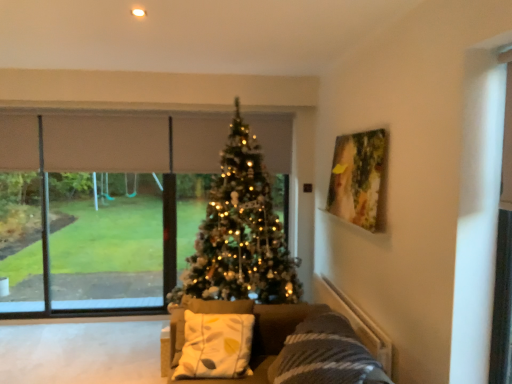
The width and height of the screenshot is (512, 384). What do you see at coordinates (240, 233) in the screenshot? I see `iridescent gold christmas tree at center` at bounding box center [240, 233].

Where is `iridescent gold christmas tree at center`? iridescent gold christmas tree at center is located at coordinates (240, 233).

Image resolution: width=512 pixels, height=384 pixels. Describe the element at coordinates (96, 239) in the screenshot. I see `transparent glass window at center` at that location.

Find the location of a particular element. This screenshot has width=512, height=384. iridescent gold christmas tree at center is located at coordinates (240, 233).

Considering the positions of objects velvet grey couch at center and iridescent gold christmas tree at center in the image provided, who is behind, velvet grey couch at center or iridescent gold christmas tree at center?

iridescent gold christmas tree at center is behind.

Which is behind, point (203, 330) or point (215, 229)?

Point (215, 229)

Which of these two, velvet grey couch at center or iridescent gold christmas tree at center, stands shorter?

Standing shorter between the two is velvet grey couch at center.

Are iridescent gold christmas tree at center and transparent glass screen door at right beside each other?

No.

Is transparent glass screen door at right completely or partially inside iridescent gold christmas tree at center?

No, transparent glass screen door at right is not surrounded by iridescent gold christmas tree at center.

The height and width of the screenshot is (384, 512). In order to click on screen door on the right of iridescent gold christmas tree at center in this screenshot , I will do `click(503, 253)`.

Who is shorter, iridescent gold christmas tree at center or transparent glass screen door at right?

Answer: transparent glass screen door at right is shorter.

Which object is thinner, wooden painting at upper right or white fabric pillow at center?

wooden painting at upper right.

From the image's perspective, which one is positioned lower, wooden painting at upper right or white fabric pillow at center?

white fabric pillow at center.

Considering the relative positions of wooden painting at upper right and white fabric pillow at center in the image provided, is wooden painting at upper right behind white fabric pillow at center?

That is True.

How many degrees apart are the facing directions of wooden painting at upper right and white fabric pillow at center?

wooden painting at upper right and white fabric pillow at center are facing 93 degrees away from each other.

Which of these two, wooden painting at upper right or transparent glass window at center, stands shorter?

wooden painting at upper right.

Is wooden painting at upper right positioned before transparent glass window at center?

That is True.

How different are the orientations of wooden painting at upper right and transparent glass window at center in degrees?

The angular difference between wooden painting at upper right and transparent glass window at center is 90.4 degrees.

From the image's perspective, which one is positioned higher, wooden painting at upper right or transparent glass window at center?

wooden painting at upper right, from the image's perspective.

Is transparent glass window at center shorter than velvet grey couch at center?

No.

Measure the distance from transparent glass window at center to velvet grey couch at center.

2.24 meters.

Is transparent glass window at center to the right of velvet grey couch at center from the viewer's perspective?

Incorrect, transparent glass window at center is not on the right side of velvet grey couch at center.

This screenshot has height=384, width=512. I want to click on window behind the velvet grey couch at center, so click(96, 239).

Is velvet grey couch at center to the left or to the right of wooden painting at upper right in the image?

Clearly, velvet grey couch at center is on the left of wooden painting at upper right in the image.

Is point (362, 347) positioned behind point (347, 195)?

No, (362, 347) is in front of (347, 195).

From the image's perspective, which is below, velvet grey couch at center or wooden painting at upper right?

velvet grey couch at center, from the image's perspective.

Considering the sizes of objects velvet grey couch at center and wooden painting at upper right in the image provided, who is thinner, velvet grey couch at center or wooden painting at upper right?

Thinner between the two is wooden painting at upper right.

In the scene shown: Considering the positions of objects velvet grey couch at center and transparent glass window at center in the image provided, who is behind, velvet grey couch at center or transparent glass window at center?

transparent glass window at center is behind.

At what (x,y) coordinates should I click in order to perform the action: click on studio couch located below the transparent glass window at center (from the image's perspective). Please return your answer as a coordinate pair (x, y). The image size is (512, 384). Looking at the image, I should click on (267, 345).

Is velvet grey couch at center to the right of transparent glass window at center from the viewer's perspective?

Indeed, velvet grey couch at center is positioned on the right side of transparent glass window at center.

Is there a large distance between velvet grey couch at center and transparent glass window at center?

Yes, velvet grey couch at center and transparent glass window at center are quite far apart.

Where is `christmas tree above the velvet grey couch at center (from a real-world perspective)`? This screenshot has width=512, height=384. christmas tree above the velvet grey couch at center (from a real-world perspective) is located at coordinates (240, 233).

You are a GUI agent. You are given a task and a screenshot of the screen. Output one action in this format:
    pyautogui.click(x=<x>, y=<y>)
    Task: Click on the christmas tree located underneath the transparent glass screen door at right (from a real-world perspective)
    
    Given the screenshot: What is the action you would take?
    pyautogui.click(x=240, y=233)

Which object lies further to the anchor point iridescent gold christmas tree at center, transparent glass screen door at right or transparent glass window at center?

transparent glass screen door at right is positioned further to the anchor iridescent gold christmas tree at center.

Considering their positions, is transparent glass screen door at right positioned closer to wooden painting at upper right than velvet grey couch at center?

Based on the image, velvet grey couch at center appears to be nearer to wooden painting at upper right.

Which object lies further to the anchor point transparent glass screen door at right, wooden painting at upper right or velvet grey couch at center?

velvet grey couch at center is further to transparent glass screen door at right.

Estimate the real-world distances between objects in this image. Which object is further from transparent glass window at center, transparent glass screen door at right or iridescent gold christmas tree at center?

transparent glass screen door at right lies further to transparent glass window at center than the other object.

Considering their positions, is velvet grey couch at center positioned further to wooden painting at upper right than white fabric pillow at center?

Based on the image, white fabric pillow at center appears to be further to wooden painting at upper right.

Estimate the real-world distances between objects in this image. Which object is further from transparent glass window at center, velvet grey couch at center or white fabric pillow at center?

white fabric pillow at center is further to transparent glass window at center.

Based on their spatial positions, is transparent glass window at center or iridescent gold christmas tree at center closer to velvet grey couch at center?

iridescent gold christmas tree at center lies closer to velvet grey couch at center than the other object.

Considering their positions, is velvet grey couch at center positioned further to white fabric pillow at center than transparent glass screen door at right?

Based on the image, transparent glass screen door at right appears to be further to white fabric pillow at center.

Where is `christmas tree between transparent glass screen door at right and transparent glass window at center in the front-back direction`? christmas tree between transparent glass screen door at right and transparent glass window at center in the front-back direction is located at coordinates (240, 233).

This screenshot has width=512, height=384. I want to click on screen door located between velvet grey couch at center and iridescent gold christmas tree at center in the depth direction, so click(x=503, y=253).

You are a GUI agent. You are given a task and a screenshot of the screen. Output one action in this format:
    pyautogui.click(x=<x>, y=<y>)
    Task: Click on the christmas tree between velvet grey couch at center and transparent glass window at center along the z-axis
    This screenshot has width=512, height=384.
    Given the screenshot: What is the action you would take?
    pyautogui.click(x=240, y=233)

Identify the location of pillow between wooden painting at upper right and velvet grey couch at center from top to bottom. (215, 346).